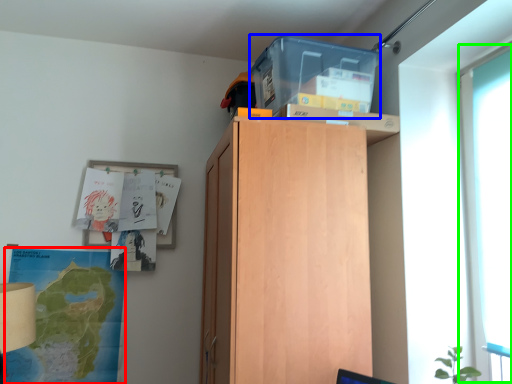
Question: Based on their relative distances, which object is farther from map (highlighted by a red box)? Choose from storage box (highlighted by a blue box) and glass door (highlighted by a green box).

Choices:
 (A) storage box
 (B) glass door

Answer: (B)